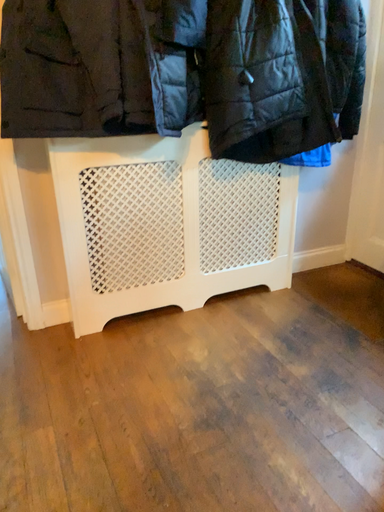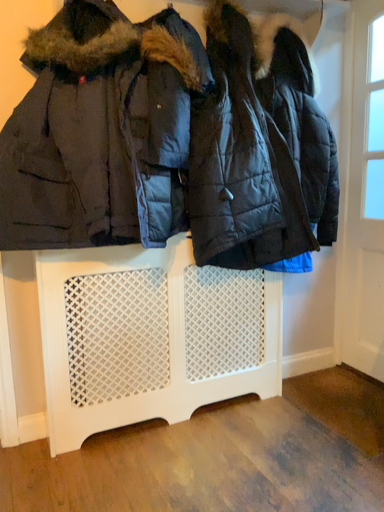
Question: Which way did the camera rotate in the video?

Choices:
 (A) rotated downward
 (B) rotated upward

Answer: (B)